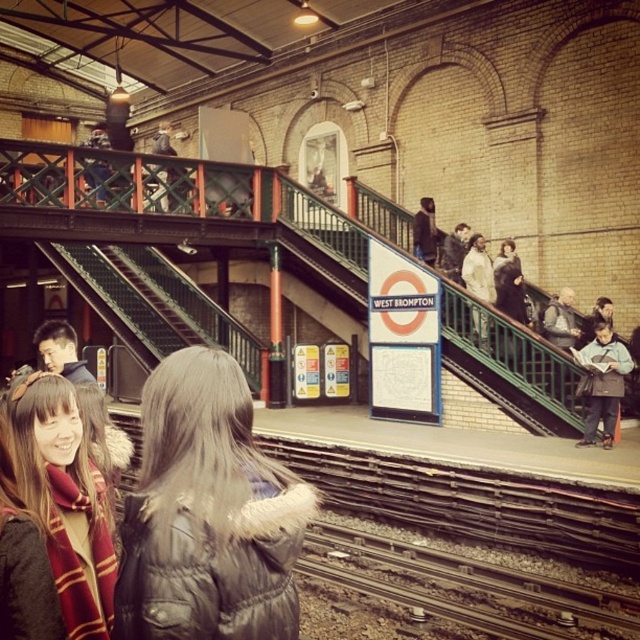
You are standing on the platform at West Brompton station. There are two points marked on the platform. Which point is closer to you, point (157,420) or point (77,588)?

Point (157,420) is closer to the viewer than point (77,588).